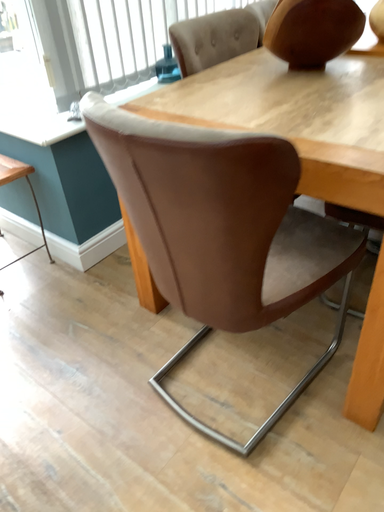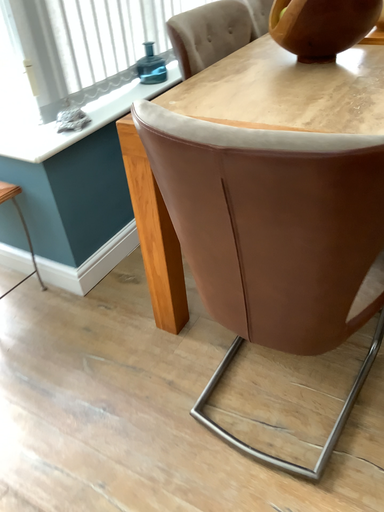
Question: Which way did the camera rotate in the video?

Choices:
 (A) rotated right
 (B) rotated left

Answer: (A)